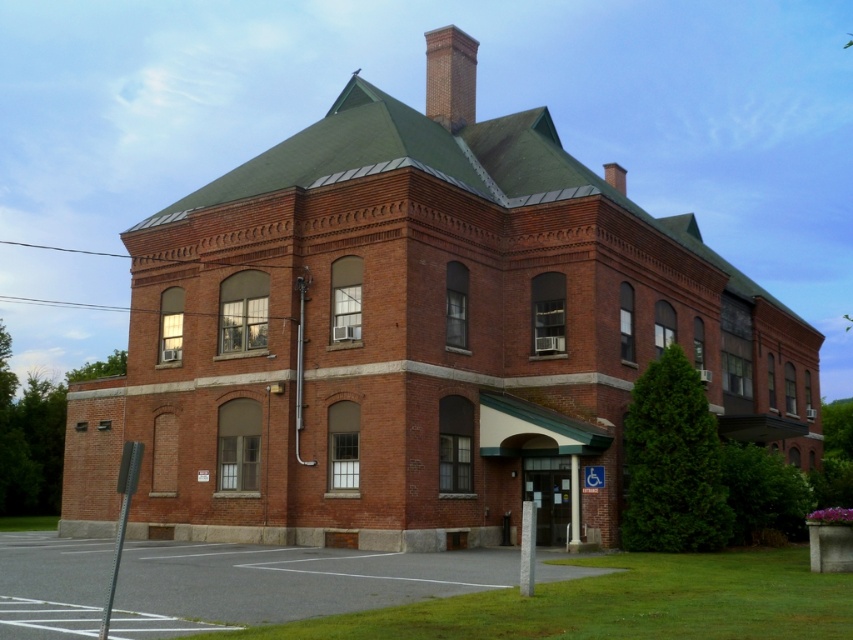
Question: Which of the following is the farthest from the observer?

Choices:
 (A) tap(625, 179)
 (B) tap(115, 540)
 (C) tap(440, 77)

Answer: (A)

Question: Is brick chimney at upper center above smooth brick chimney at upper center?

Choices:
 (A) yes
 (B) no

Answer: (A)

Question: Which of these objects is positioned closest to the brick chimney at upper center?

Choices:
 (A) smooth gray pole at lower left
 (B) smooth brick chimney at upper center

Answer: (B)

Question: Does brick chimney at upper center lie in front of smooth brick chimney at upper center?

Choices:
 (A) no
 (B) yes

Answer: (B)

Question: Estimate the real-world distances between objects in this image. Which object is farther from the brick chimney at upper center?

Choices:
 (A) smooth brick chimney at upper center
 (B) smooth gray pole at lower left

Answer: (B)

Question: Is smooth gray pole at lower left bigger than smooth brick chimney at upper center?

Choices:
 (A) yes
 (B) no

Answer: (B)